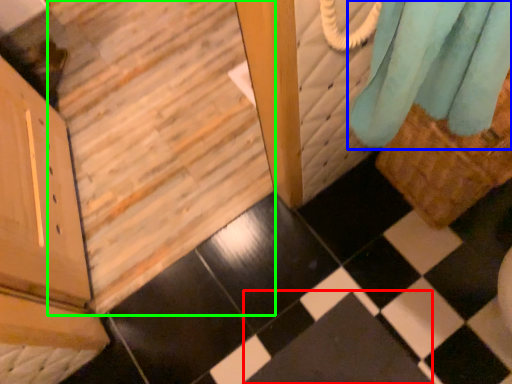
Question: Which object is the farthest from square (highlighted by a red box)? Choose among these: curtain (highlighted by a blue box) or stairwell (highlighted by a green box).

Choices:
 (A) curtain
 (B) stairwell

Answer: (B)